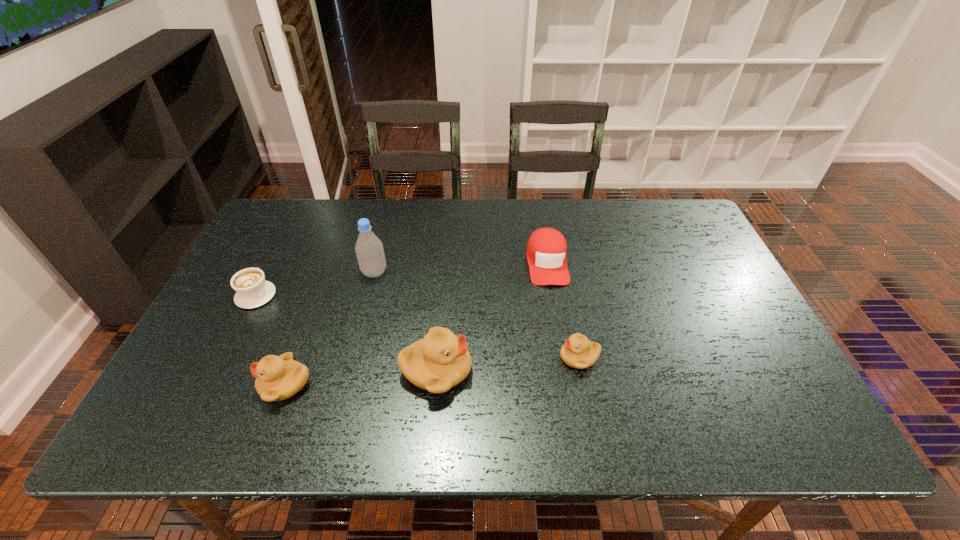
Where is `object at the far edge`? This screenshot has height=540, width=960. object at the far edge is located at coordinates (546, 251).

Find the location of `object at the left edge`. object at the left edge is located at coordinates [252, 290].

You are a GUI agent. You are given a task and a screenshot of the screen. Output one action in this format:
    pyautogui.click(x=<x>, y=<y>)
    Task: Click on the vacant space at the far edge
    This screenshot has height=540, width=960.
    Given the screenshot: What is the action you would take?
    pyautogui.click(x=372, y=222)

Find the location of a particular element. This screenshot has width=960, height=540. vacant space at the near edge of the desktop is located at coordinates (516, 389).

This screenshot has width=960, height=540. Find the location of `vacant region at the left edge of the desktop`. vacant region at the left edge of the desktop is located at coordinates (261, 319).

Where is `vacant space at the right edge`? vacant space at the right edge is located at coordinates (658, 246).

At what (x,y) coordinates should I click in order to perform the action: click on vacant space at the near left corner of the desktop. Please return your answer as a coordinate pair (x, y). The image size is (960, 540). Looking at the image, I should click on (183, 384).

Locate an element on the screen. vacant point located between the baseball cap and the third object from right to left is located at coordinates (492, 316).

Where is `free area in between the second object from left to right and the second tallest object`? free area in between the second object from left to right and the second tallest object is located at coordinates (361, 377).

Where is `free space between the tallest object and the fifth shortest object`? The image size is (960, 540). free space between the tallest object and the fifth shortest object is located at coordinates (405, 321).